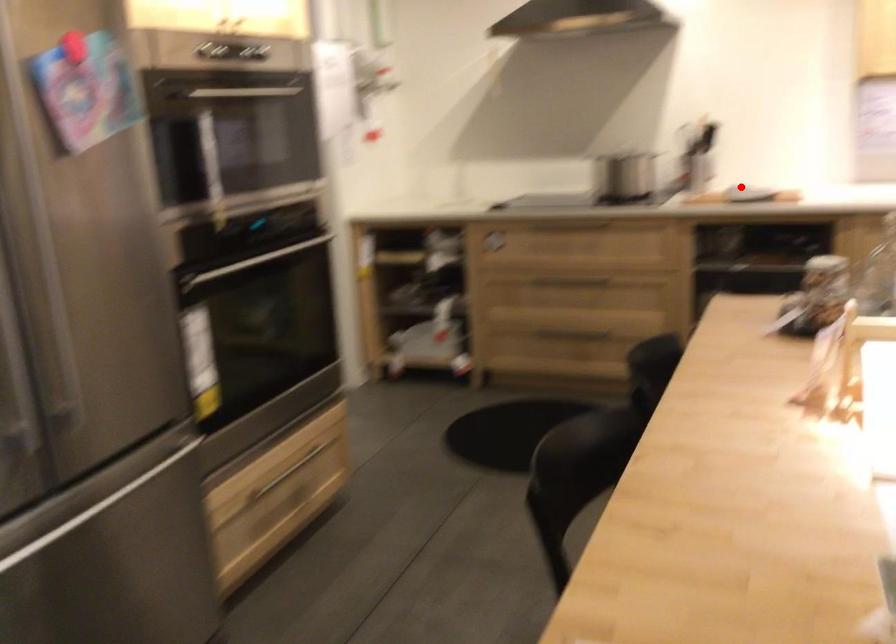
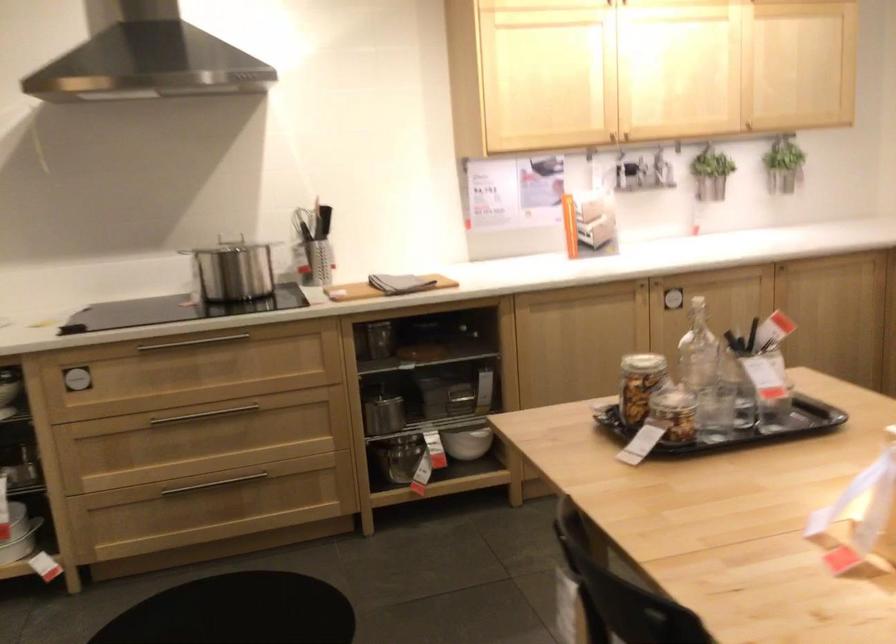
Find the pixel in the second image that matches the highlighted location in the first image.

(388, 286)